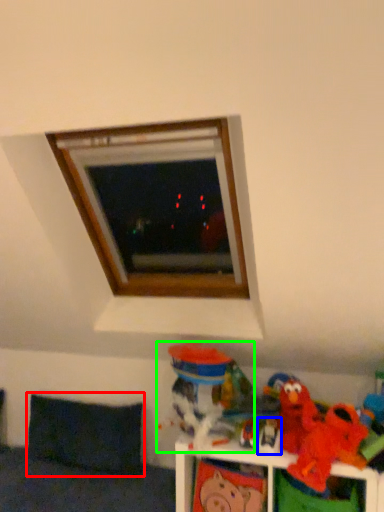
Question: Which object is the farthest from pillow (highlighted by a red box)? Choose among these: toy (highlighted by a blue box) or toy (highlighted by a green box).

Choices:
 (A) toy
 (B) toy

Answer: (A)